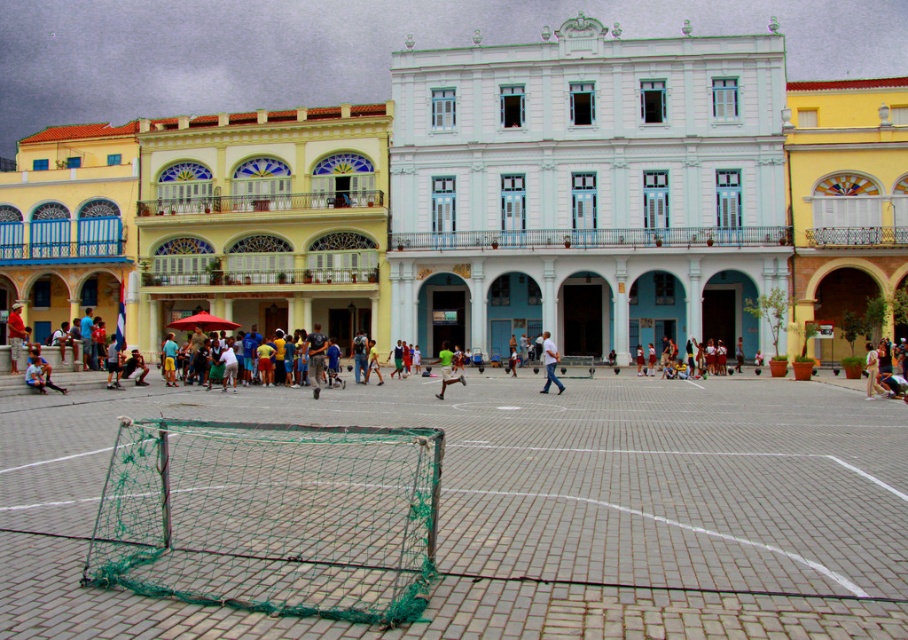
Question: Does white cotton shirt at center come in front of green jersey at center?

Choices:
 (A) no
 (B) yes

Answer: (B)

Question: Which point is closer to the camera taking this photo?

Choices:
 (A) (876, 376)
 (B) (549, 355)
 (C) (445, 381)
 (D) (38, 378)

Answer: (D)

Question: Among these objects, which one is farthest from the camera?

Choices:
 (A) green fabric shorts at center
 (B) white matte pants at center

Answer: (A)

Question: Is white cotton shirt at center smaller than light blue fabric shorts at lower left?

Choices:
 (A) no
 (B) yes

Answer: (A)

Question: Which point appears closest to the camera in this image?

Choices:
 (A) (439, 396)
 (B) (546, 349)
 (C) (881, 342)

Answer: (A)

Question: Can you confirm if white cotton shirt at center is thinner than white matte pants at center?

Choices:
 (A) no
 (B) yes

Answer: (A)